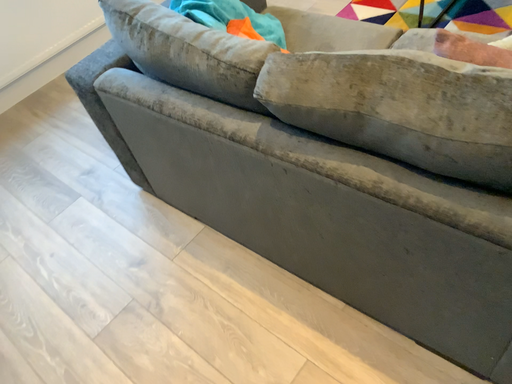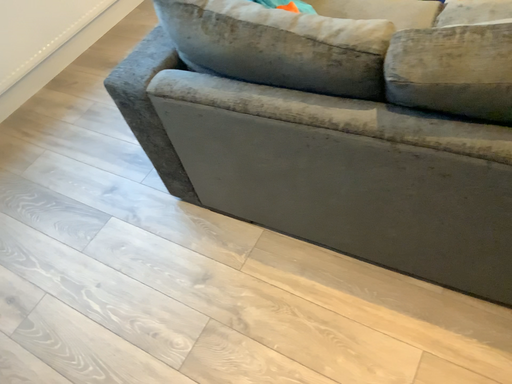
Question: Which way did the camera rotate in the video?

Choices:
 (A) rotated right
 (B) rotated left

Answer: (A)